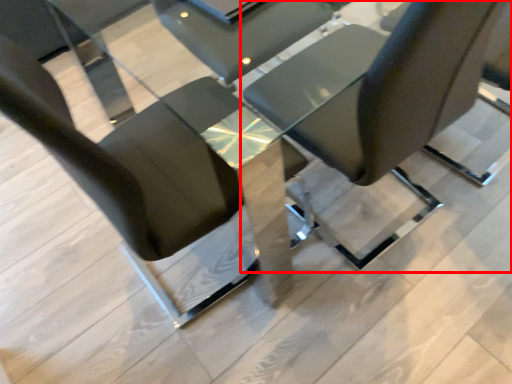
Question: From the image, what is the correct spatial relationship of chair (annotated by the red box) in relation to chair?

Choices:
 (A) left
 (B) right

Answer: (B)